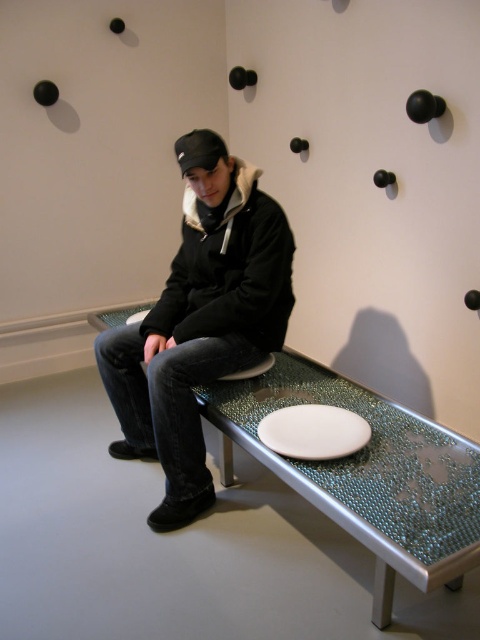
Question: Which of these objects is positioned closest to the white glossy plate at center?

Choices:
 (A) white matte platter at center
 (B) translucent glass bench at center
 (C) black matte jacket at center

Answer: (C)

Question: Estimate the real-world distances between objects in this image. Which object is farther from the white matte platter at center?

Choices:
 (A) translucent glass bench at center
 (B) white glossy plate at center
 (C) black matte jacket at center

Answer: (C)

Question: Does black matte jacket at center appear over white matte platter at center?

Choices:
 (A) no
 (B) yes

Answer: (B)

Question: Can you confirm if translucent glass bench at center is wider than white matte platter at center?

Choices:
 (A) no
 (B) yes

Answer: (B)

Question: Estimate the real-world distances between objects in this image. Which object is farther from the white glossy plate at center?

Choices:
 (A) black matte jacket at center
 (B) translucent glass bench at center
 (C) white matte platter at center

Answer: (C)

Question: Can you confirm if black matte jacket at center is wider than white glossy plate at center?

Choices:
 (A) no
 (B) yes

Answer: (B)